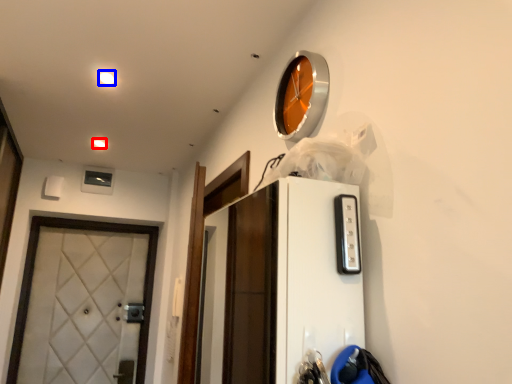
Question: Among these objects, which one is nearest to the camera, light (highlighted by a red box) or light (highlighted by a blue box)?

Choices:
 (A) light
 (B) light

Answer: (B)